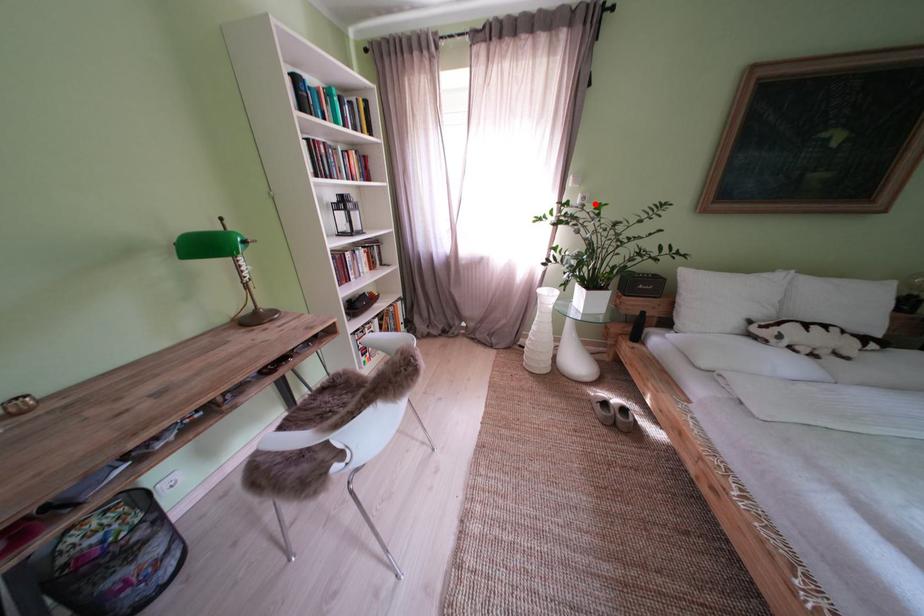
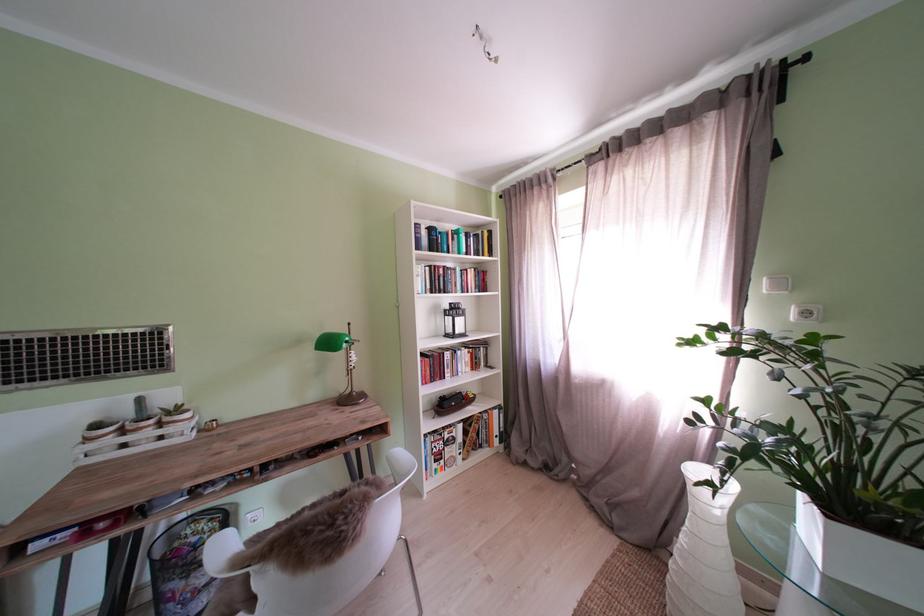
Question: I am providing you with two images of the same scene from different viewpoints. A red point is shown in image1. For the corresponding object point in image2, is it positioned nearer or farther from the camera?

Choices:
 (A) Nearer
 (B) Farther

Answer: (B)